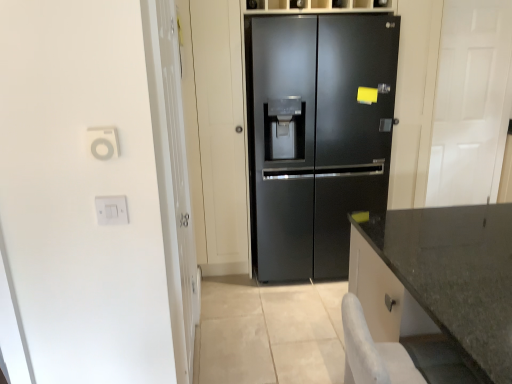
Question: Can you see granite gray countertop at lower right touching white glossy door at right, the second glass door viewed from the front?

Choices:
 (A) no
 (B) yes

Answer: (A)

Question: Is granite gray countertop at lower right looking in the opposite direction of white glossy door at right, the second glass door viewed from the front?

Choices:
 (A) yes
 (B) no

Answer: (B)

Question: From a real-world perspective, does granite gray countertop at lower right sit lower than white glossy door at right, the second glass door viewed from the front?

Choices:
 (A) yes
 (B) no

Answer: (A)

Question: Is white glossy door at right, the 1th glass door in the right-to-left sequence, located within granite gray countertop at lower right?

Choices:
 (A) no
 (B) yes

Answer: (A)

Question: From the image's perspective, is granite gray countertop at lower right over white glossy door at right, the second glass door viewed from the front?

Choices:
 (A) no
 (B) yes

Answer: (A)

Question: Which is correct: granite gray countertop at lower right is inside white glossy door at right, the second glass door viewed from the front, or outside of it?

Choices:
 (A) outside
 (B) inside

Answer: (A)

Question: From their relative heights in the image, would you say granite gray countertop at lower right is taller or shorter than white glossy door at right, the 1th glass door in the right-to-left sequence?

Choices:
 (A) tall
 (B) short

Answer: (B)

Question: From a real-world perspective, is granite gray countertop at lower right physically located above or below white glossy door at right, the 1th glass door in the right-to-left sequence?

Choices:
 (A) above
 (B) below

Answer: (B)

Question: From the image's perspective, is granite gray countertop at lower right located above or below white glossy door at right, the 1th glass door in the right-to-left sequence?

Choices:
 (A) above
 (B) below

Answer: (B)

Question: From a real-world perspective, is black matte refrigerator at center physically located above or below white glossy door at right, marked as the second glass door in a left-to-right arrangement?

Choices:
 (A) above
 (B) below

Answer: (B)

Question: In terms of size, does black matte refrigerator at center appear bigger or smaller than white glossy door at right, marked as the second glass door in a left-to-right arrangement?

Choices:
 (A) small
 (B) big

Answer: (B)

Question: Does point (253, 167) appear closer or farther from the camera than point (482, 150)?

Choices:
 (A) closer
 (B) farther

Answer: (A)

Question: In terms of height, does black matte refrigerator at center look taller or shorter compared to white glossy door at right, the second glass door viewed from the front?

Choices:
 (A) tall
 (B) short

Answer: (B)

Question: In the image, is white plastic outlet at upper left, which is counted as the 2th electric outlet, starting from the back, positioned in front of or behind white plastic switch at left, arranged as the second electric outlet when viewed from the front?

Choices:
 (A) behind
 (B) front

Answer: (B)

Question: Based on their sizes in the image, would you say white plastic outlet at upper left, the 1th electric outlet from the top, is bigger or smaller than white plastic switch at left, placed as the first electric outlet when sorted from back to front?

Choices:
 (A) small
 (B) big

Answer: (B)